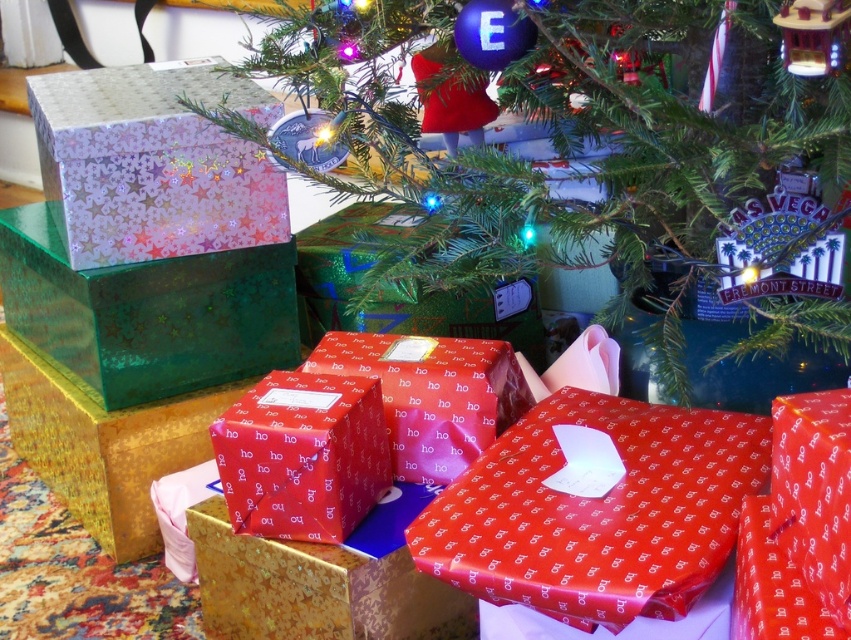
Based on the photo, can you confirm if metallic green box at center is bigger than green shiny box at left?

Yes.

Who is higher up, metallic green box at center or green shiny box at left?

metallic green box at center

The image size is (851, 640). Describe the element at coordinates (610, 154) in the screenshot. I see `metallic green box at center` at that location.

You are a GUI agent. You are given a task and a screenshot of the screen. Output one action in this format:
    pyautogui.click(x=<x>, y=<y>)
    Task: Click on the metallic green box at center
    This screenshot has width=851, height=640.
    Given the screenshot: What is the action you would take?
    pyautogui.click(x=610, y=154)

The image size is (851, 640). What are the coordinates of `green shiny box at left` in the screenshot? It's located at (147, 312).

Who is positioned more to the left, green shiny box at left or gold textured box at center?

green shiny box at left is more to the left.

Who is more forward, (43, 301) or (381, 634)?

Positioned in front is point (381, 634).

Find the location of a particular element. Image resolution: width=851 pixels, height=640 pixels. green shiny box at left is located at coordinates (147, 312).

Between green shiny box at left and shiny green wrapping paper at center, which one is positioned higher?

shiny green wrapping paper at center is higher up.

Is point (152, 337) behind point (440, 300)?

No, (152, 337) is closer to viewer.

Between point (23, 264) and point (488, 321), which one is positioned in front?

Point (23, 264) is more forward.

At what (x,y) coordinates should I click in order to perform the action: click on green shiny box at left. Please return your answer as a coordinate pair (x, y). The height and width of the screenshot is (640, 851). Looking at the image, I should click on pyautogui.click(x=147, y=312).